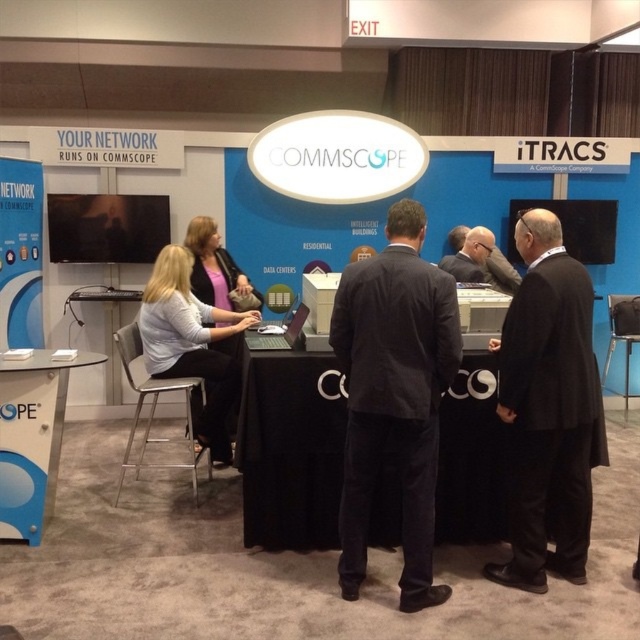
You are a photographer at the Commscope booth and need to capture a clear photo of both the dark gray suit at center and the black wool coat at center. Since the camera can only focus on one object at a time, which object should you focus on first to ensure the taller object is in focus?

The dark gray suit at center is taller than the black wool coat at center, so you should focus on the dark gray suit at center first to ensure its height is properly captured.

You are a photographer at the Commscope exhibition booth. You need to capture a photo of the light gray fabric shirt at center and the black suit at center. Which one should you zoom in on to ensure the subject fills the frame without cropping?

The light gray fabric shirt at center has a larger width than the black suit at center, so you should zoom in on the light gray fabric shirt at center to ensure it fills the frame without cropping.

You are a photographer at the Commscope trade show booth. You need to take a photo of both the dark gray suit at center and the silver metallic laptop at center. Based on their positions, which object will appear closer to the camera in the photo?

The dark gray suit at center will appear closer to the camera in the photo because it is in front of the silver metallic laptop at center.